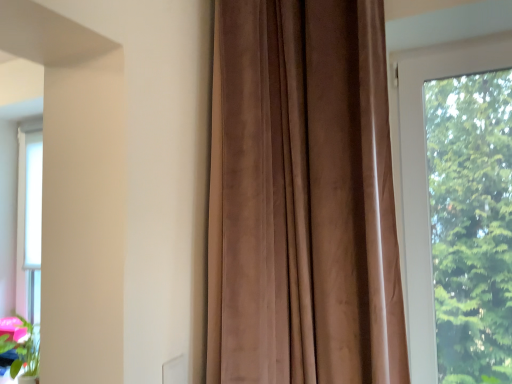
Question: From the image's perspective, is suede-like brown curtain at center positioned above or below transparent glass window at right?

Choices:
 (A) below
 (B) above

Answer: (B)

Question: From their relative heights in the image, would you say suede-like brown curtain at center is taller or shorter than transparent glass window at right?

Choices:
 (A) tall
 (B) short

Answer: (A)

Question: Considering the positions of point coord(350,347) and point coord(397,221), is point coord(350,347) closer or farther from the camera than point coord(397,221)?

Choices:
 (A) closer
 (B) farther

Answer: (A)

Question: Would you say transparent glass window at right is to the left or to the right of suede-like brown curtain at center in the picture?

Choices:
 (A) left
 (B) right

Answer: (B)

Question: Does point (406, 256) appear closer or farther from the camera than point (304, 158)?

Choices:
 (A) closer
 (B) farther

Answer: (B)

Question: Looking at the image, does transparent glass window at right seem bigger or smaller compared to suede-like brown curtain at center?

Choices:
 (A) small
 (B) big

Answer: (A)

Question: From the image's perspective, is transparent glass window at right above or below suede-like brown curtain at center?

Choices:
 (A) above
 (B) below

Answer: (B)